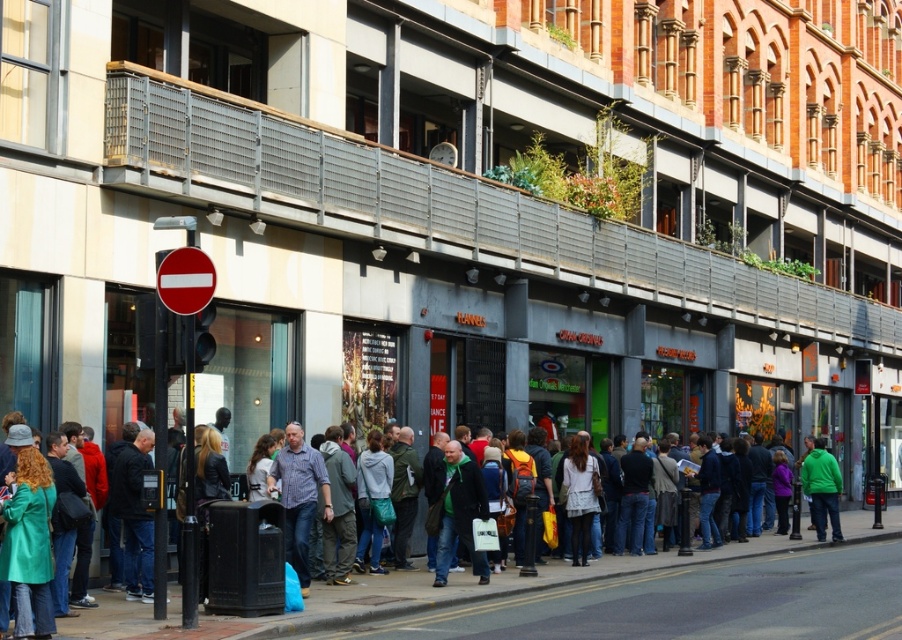
Question: Which point is closer to the camera?

Choices:
 (A) (465, 474)
 (B) (284, 538)
 (C) (562, 634)

Answer: (C)

Question: Does green fabric jacket at center appear on the left side of green fleece jacket at center?

Choices:
 (A) no
 (B) yes

Answer: (B)

Question: Which of the following is the closest to the observer?

Choices:
 (A) blue jeans at center
 (B) concrete sidewalk at lower center

Answer: (B)

Question: Which object is closer to the camera taking this photo?

Choices:
 (A) concrete sidewalk at lower center
 (B) green fabric jacket at center
 (C) blue jeans at center

Answer: (A)

Question: Can you confirm if concrete sidewalk at lower center is smaller than green fleece jacket at center?

Choices:
 (A) no
 (B) yes

Answer: (A)

Question: Is concrete sidewalk at lower center positioned before green fabric jacket at center?

Choices:
 (A) no
 (B) yes

Answer: (B)